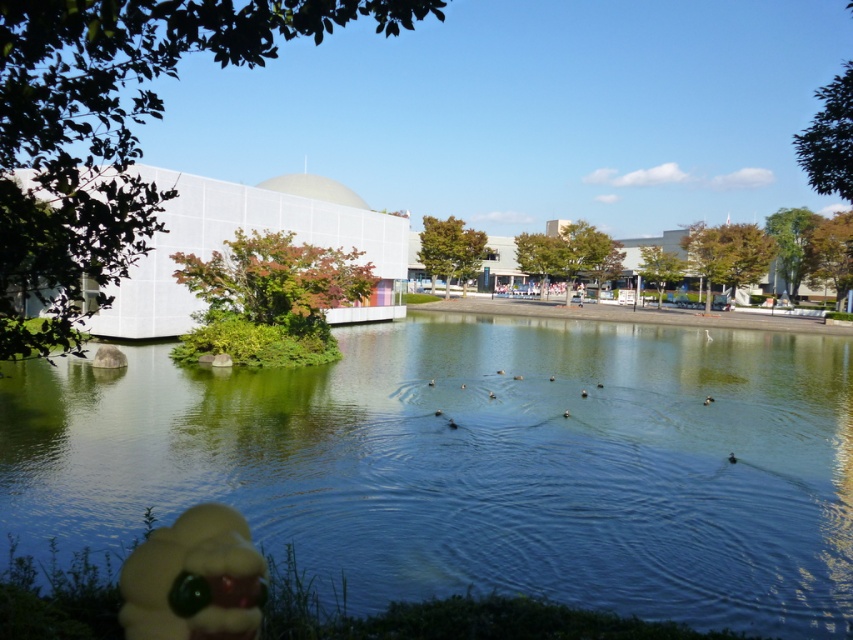
You are standing at the point marked as point (476, 464) in the image. What do you see directly in front of you?

You see clear water at pond center directly in front of you at point (476, 464).

From the picture: You are a photographer planning to capture the reflection of the modern building with a white facade and large rounded dome in the clear water at pond center. However, there is a yellow rubber duck at lower left in the scene. Will the duck obstruct the reflection of the building in the water?

The clear water at pond center is larger in size than the yellow rubber duck at lower left, so the duck will not obstruct the reflection of the building in the water since there is enough space around it.